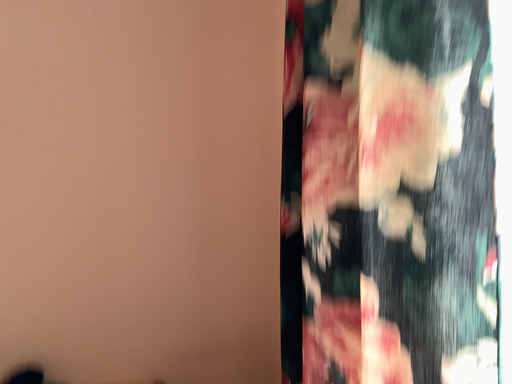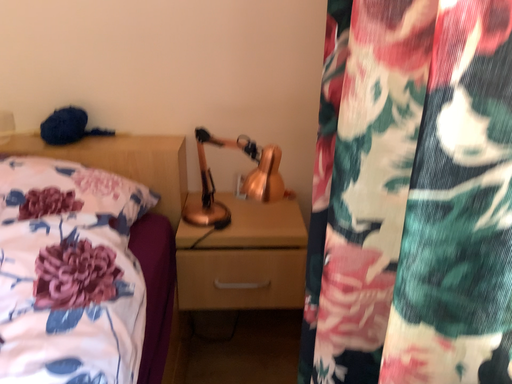
Question: How did the camera likely rotate when shooting the video?

Choices:
 (A) rotated left
 (B) rotated right

Answer: (A)